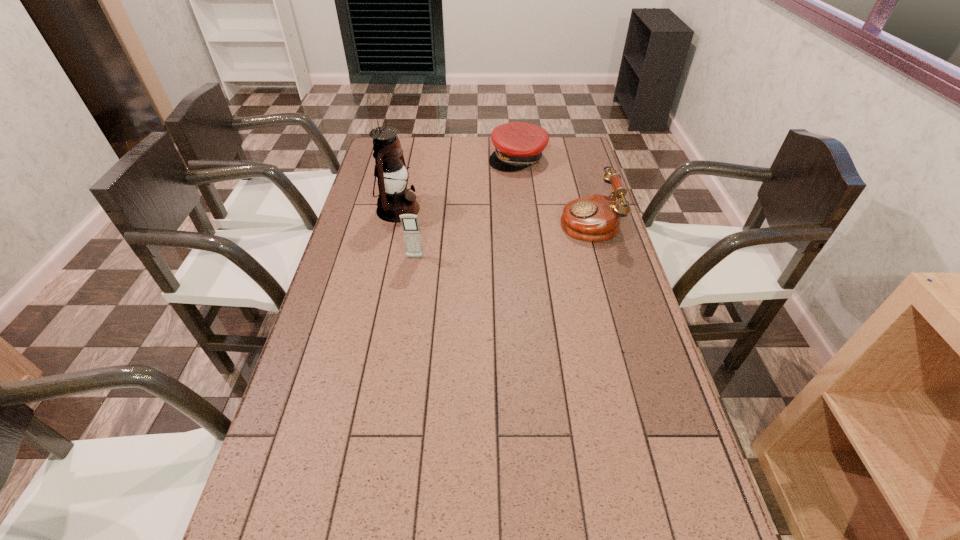
The width and height of the screenshot is (960, 540). In order to click on free space located 0.060m on the front-facing side of the farthest object in this screenshot , I will do `click(518, 181)`.

I want to click on vacant space located on the front-facing side of the farthest object, so click(x=519, y=222).

Locate an element on the screen. This screenshot has width=960, height=540. vacant area located on the side of the lantern, there is a wick adjustment knob is located at coordinates (496, 230).

At what (x,y) coordinates should I click in order to perform the action: click on blank area located on the side of the lantern, there is a wick adjustment knob. Please return your answer as a coordinate pair (x, y). This screenshot has height=540, width=960. Looking at the image, I should click on (501, 231).

The image size is (960, 540). I want to click on vacant space located 0.380m on the side of the lantern, there is a wick adjustment knob, so click(x=521, y=235).

Locate an element on the screen. This screenshot has width=960, height=540. object located in the far edge section of the desktop is located at coordinates (518, 145).

Where is `object that is at the left edge`? object that is at the left edge is located at coordinates (394, 199).

Identify the location of object at the right edge. (596, 217).

Image resolution: width=960 pixels, height=540 pixels. I want to click on free space at the far edge, so click(x=460, y=156).

I want to click on free space at the near edge of the desktop, so click(x=425, y=530).